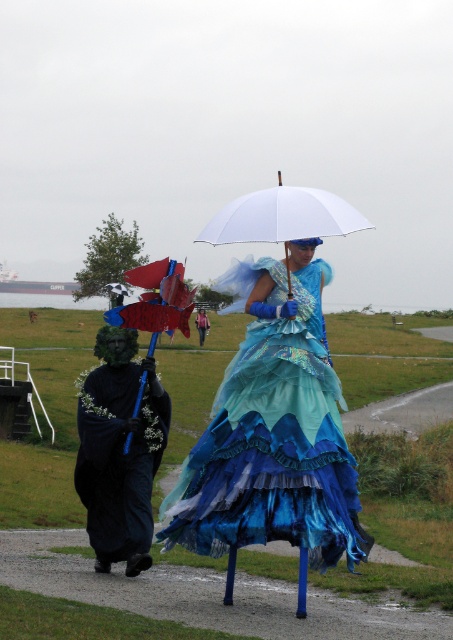
Looking at this image, what is the color of the robe located at point (x=120, y=451) in the image?

The robe at point (x=120, y=451) is black matte velvet.